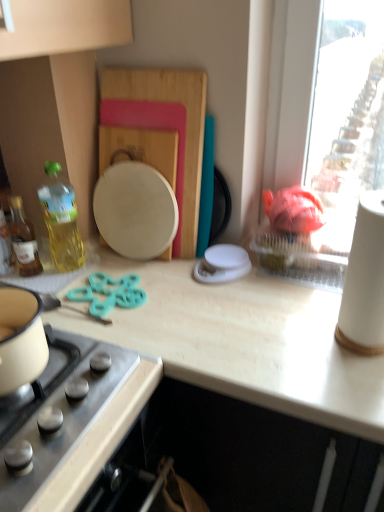
Where is `free area behind white paper towel at right`? free area behind white paper towel at right is located at coordinates (304, 298).